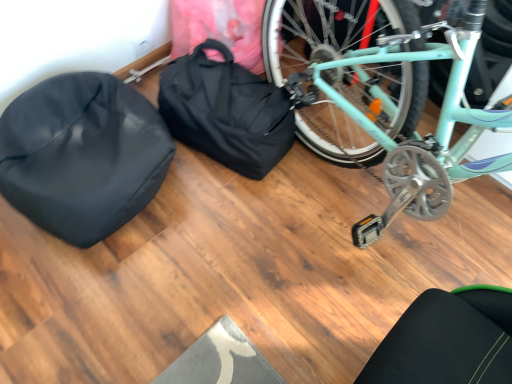
What do you see at coordinates (82, 155) in the screenshot? The height and width of the screenshot is (384, 512). I see `black matte sleeping bag at left` at bounding box center [82, 155].

Measure the distance between point [94,170] and camera.

The depth of point [94,170] is 3.83 feet.

Image resolution: width=512 pixels, height=384 pixels. In order to click on black matte sleeping bag at left in this screenshot , I will do `click(82, 155)`.

In order to click on black fabric bag at center in this screenshot , I will do `click(226, 111)`.

Describe the element at coordinates (226, 111) in the screenshot. This screenshot has height=384, width=512. I see `black fabric bag at center` at that location.

In order to face black fabric bag at center, should I rotate leftwards or rightwards?

Rotate your view left by about 3.786°.

Identify the location of black matte sleeping bag at left. This screenshot has width=512, height=384. (82, 155).

Between black fabric bag at center and black matte sleeping bag at left, which one appears on the left side from the viewer's perspective?

Positioned to the left is black matte sleeping bag at left.

Between black fabric bag at center and black matte sleeping bag at left, which one is positioned behind?

black fabric bag at center is further from the camera.

Which is nearer, (x=221, y=134) or (x=134, y=90)?

The point (x=221, y=134) is closer to the camera.

From the image's perspective, is black fabric bag at center located above or below black matte sleeping bag at left?

Clearly, from the image's perspective, black fabric bag at center is above black matte sleeping bag at left.

From a real-world perspective, who is located higher, black fabric bag at center or black matte sleeping bag at left?

black matte sleeping bag at left.

Is black fabric bag at center thinner than black matte sleeping bag at left?

Correct, the width of black fabric bag at center is less than that of black matte sleeping bag at left.

Can you confirm if black fabric bag at center is taller than black matte sleeping bag at left?

Indeed, black fabric bag at center has a greater height compared to black matte sleeping bag at left.

Can you confirm if black fabric bag at center is bigger than black matte sleeping bag at left?

Actually, black fabric bag at center might be smaller than black matte sleeping bag at left.

Can we say black fabric bag at center lies outside black matte sleeping bag at left?

Yes, black fabric bag at center is not within black matte sleeping bag at left.

Is black fabric bag at center placed right next to black matte sleeping bag at left?

No, black fabric bag at center is not making contact with black matte sleeping bag at left.

Looking at this image, is black fabric bag at center oriented away from black matte sleeping bag at left?

No, black fabric bag at center is not facing the opposite direction of black matte sleeping bag at left.

How much distance is there between black fabric bag at center and black matte sleeping bag at left?

The distance of black fabric bag at center from black matte sleeping bag at left is 29.54 centimeters.

Identify the location of bag lying behind the black matte sleeping bag at left. (226, 111).

Which is more to the left, black matte sleeping bag at left or black fabric bag at center?

Positioned to the left is black matte sleeping bag at left.

Who is more distant, black matte sleeping bag at left or black fabric bag at center?

black fabric bag at center is further away from the camera.

Which is closer, (136, 156) or (274, 123)?

The point (136, 156) is closer to the camera.

From the image's perspective, between black matte sleeping bag at left and black fabric bag at center, who is located below?

black matte sleeping bag at left is shown below in the image.

From a real-world perspective, who is located lower, black matte sleeping bag at left or black fabric bag at center?

In real-world perspective, black fabric bag at center is lower.

Does black matte sleeping bag at left have a greater width compared to black fabric bag at center?

Yes, black matte sleeping bag at left is wider than black fabric bag at center.

Who is taller, black matte sleeping bag at left or black fabric bag at center?

Standing taller between the two is black fabric bag at center.

Between black matte sleeping bag at left and black fabric bag at center, which one has smaller size?

black fabric bag at center.

Would you say black matte sleeping bag at left is outside black fabric bag at center?

black matte sleeping bag at left is positioned outside black fabric bag at center.

Is black matte sleeping bag at left with black fabric bag at center?

No, black matte sleeping bag at left is not beside black fabric bag at center.

Is black matte sleeping bag at left oriented towards black fabric bag at center?

No, black matte sleeping bag at left is not turned towards black fabric bag at center.

Where is `sleeping bag that is below the black fabric bag at center (from the image's perspective)`? The height and width of the screenshot is (384, 512). sleeping bag that is below the black fabric bag at center (from the image's perspective) is located at coordinates (82, 155).

Where is `sleeping bag in front of the black fabric bag at center`? sleeping bag in front of the black fabric bag at center is located at coordinates (82, 155).

You are a GUI agent. You are given a task and a screenshot of the screen. Output one action in this format:
    pyautogui.click(x=<x>, y=<y>)
    Task: Click on the bag lying behind the black matte sleeping bag at left
    
    Given the screenshot: What is the action you would take?
    [x=226, y=111]